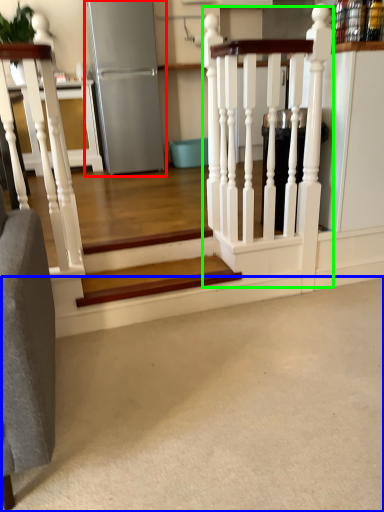
Question: Based on their relative distances, which object is farther from appliance (highlighted by a red box)? Choose from concrete (highlighted by a blue box) and rail (highlighted by a green box).

Choices:
 (A) concrete
 (B) rail

Answer: (A)